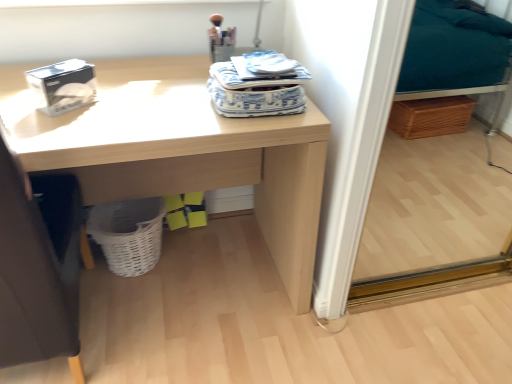
You are a GUI agent. You are given a task and a screenshot of the screen. Output one action in this format:
    pyautogui.click(x=<x>, y=<y>)
    Task: Click on the free space in front of white matte tissue box at upper left, which ranks as the first box in left-to-right order
    The height and width of the screenshot is (384, 512).
    Given the screenshot: What is the action you would take?
    pyautogui.click(x=56, y=125)